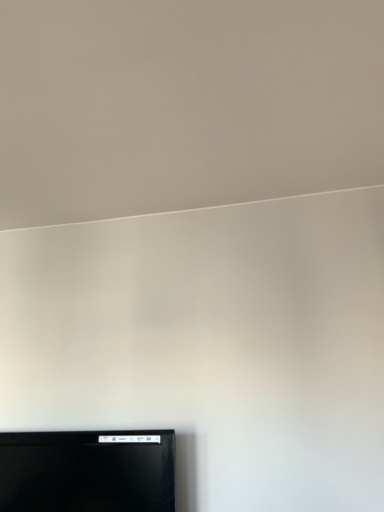
Measure the distance between point (35, 435) and camera.

A distance of 1.60 meters exists between point (35, 435) and camera.

In order to face black glossy tv at lower left, should I rotate leftwards or rightwards?

Rotate left and turn 15.468 degrees.

The width and height of the screenshot is (384, 512). What do you see at coordinates (87, 472) in the screenshot? I see `black glossy tv at lower left` at bounding box center [87, 472].

You are a GUI agent. You are given a task and a screenshot of the screen. Output one action in this format:
    pyautogui.click(x=<x>, y=<y>)
    Task: Click on the black glossy tv at lower left
    This screenshot has width=384, height=512.
    Given the screenshot: What is the action you would take?
    pyautogui.click(x=87, y=472)

You are a GUI agent. You are given a task and a screenshot of the screen. Output one action in this format:
    pyautogui.click(x=<x>, y=<y>)
    Task: Click on the black glossy tv at lower left
    
    Given the screenshot: What is the action you would take?
    pyautogui.click(x=87, y=472)